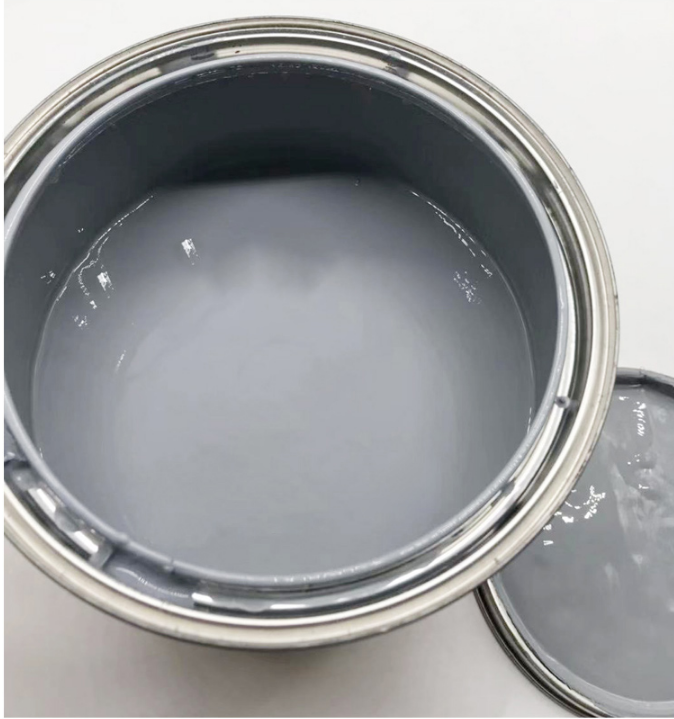
I want to click on gray paint, so click(x=311, y=452).